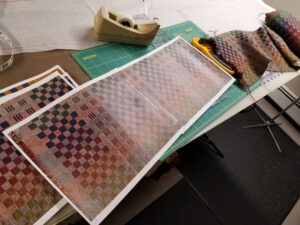
Locate an element on the screen. This screenshot has width=300, height=225. table leg is located at coordinates (215, 145).